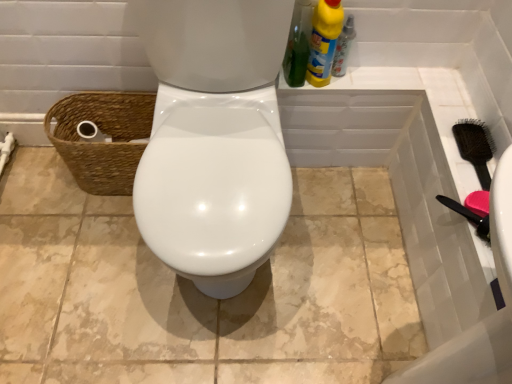
Question: From a real-world perspective, is yellow liquid cleaner at upper right, which is the 2th cleaning product from right to left, positioned above or below black plastic brush at right?

Choices:
 (A) below
 (B) above

Answer: (B)

Question: Would you say yellow liquid cleaner at upper right, which is the 2th cleaning product from right to left, is to the left or to the right of black plastic brush at right in the picture?

Choices:
 (A) right
 (B) left

Answer: (B)

Question: Which object is positioned closest to the brown woven basket at left?

Choices:
 (A) yellow plastic bottle at upper right
 (B) yellow liquid cleaner at upper right, which is the first cleaning product in left-to-right order
 (C) black plastic brush at right
 (D) yellow plastic bottle at upper right, placed as the first cleaning product when sorted from right to left

Answer: (B)

Question: Considering the real-world distances, which object is closest to the yellow plastic bottle at upper right?

Choices:
 (A) brown woven basket at left
 (B) black plastic brush at right
 (C) yellow liquid cleaner at upper right, which is the first cleaning product in left-to-right order
 (D) yellow plastic bottle at upper right, placed as the first cleaning product when sorted from right to left

Answer: (D)